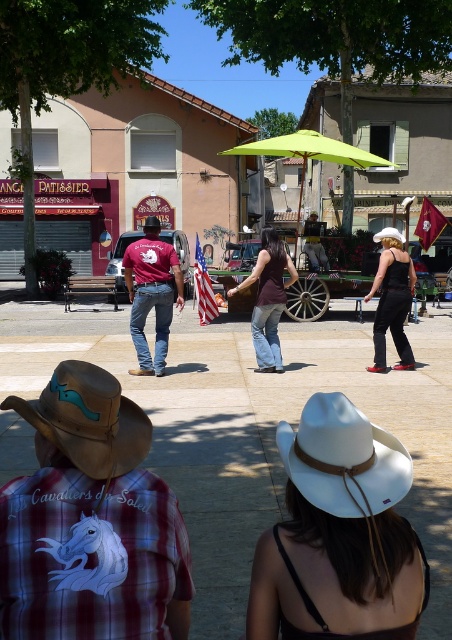
You are a photographer at the town square and want to capture both the plaid shirt at center and the american flag at center in a single frame. Given that your camera has a fixed focal length, which object should you focus on to ensure both are in the frame?

Since the plaid shirt at center is narrower than the american flag at center, you should focus on the wider object, the american flag at center, to ensure both fit within the frame.

You are a photographer standing in the town square. You want to take a photo of the plaid shirt at center and the american flag at center. Which object is closer to the camera?

The plaid shirt at center is positioned under the american flag at center, so the plaid shirt at center is closer to the camera.

You are standing in the town square and see the plaid shirt at center and the american flag at center. Which one is positioned to the right?

The plaid shirt at center is positioned to the right of the american flag at center.